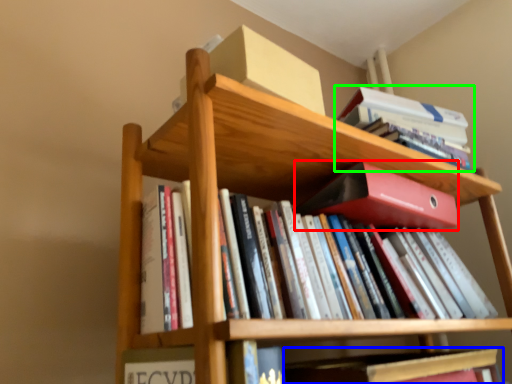
Question: Which object is positioned closest to paperback book (highlighted by a red box)? Select from book (highlighted by a blue box) and book (highlighted by a green box).

Choices:
 (A) book
 (B) book

Answer: (B)